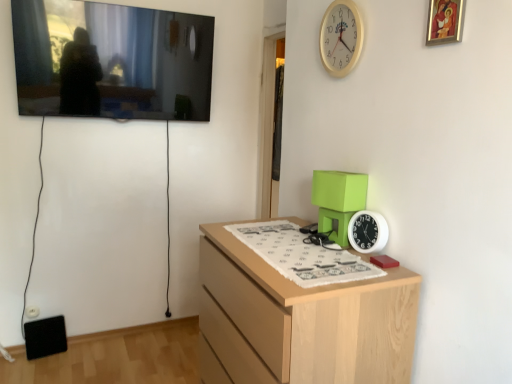
The height and width of the screenshot is (384, 512). Find the location of `vacant space to the left of white plastic clock at right, the 2th clock viewed from the top`. vacant space to the left of white plastic clock at right, the 2th clock viewed from the top is located at coordinates (322, 253).